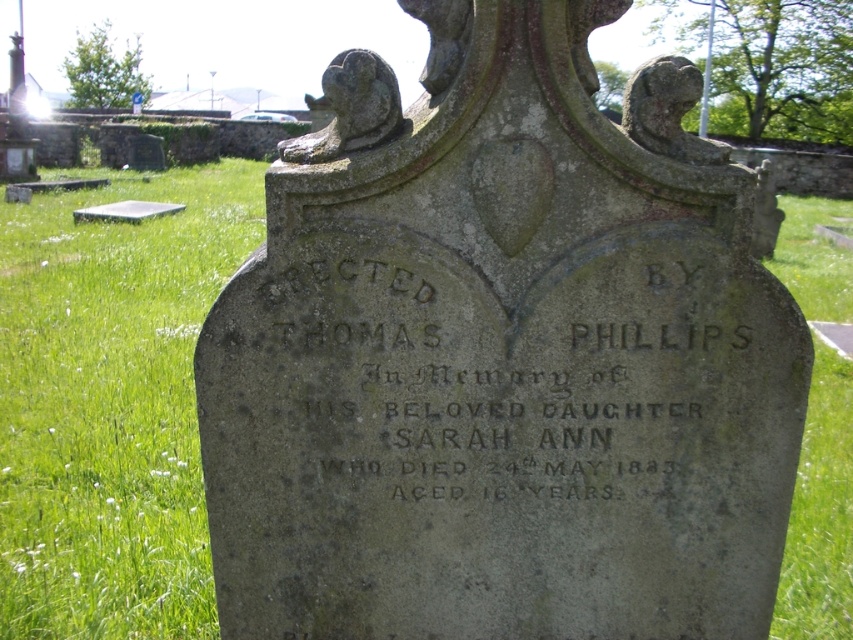
Between gray stone monument at center and black stone inscription at center, which one is positioned lower?

black stone inscription at center is below.

Identify the location of gray stone monument at center. The width and height of the screenshot is (853, 640). (502, 358).

Identify the location of gray stone monument at center. (502, 358).